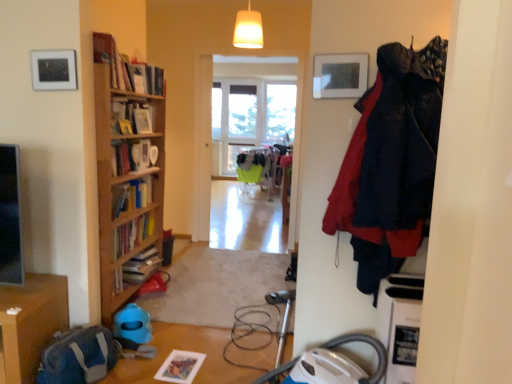
Question: Looking at their shapes, would you say white glossy bookshelf at upper left is wider or thinner than matte white picture frame at upper left?

Choices:
 (A) thin
 (B) wide

Answer: (B)

Question: In the image, is white glossy bookshelf at upper left positioned in front of or behind matte white picture frame at upper left?

Choices:
 (A) front
 (B) behind

Answer: (B)

Question: Which of these objects is positioned farthest from the wooden table at lower left?

Choices:
 (A) wooden bookcase at left
 (B) clear glass window at center, the 1th window from the left
 (C) dark blue fabric coat at right
 (D) transparent glass window at center, the 2th window positioned from the left
 (E) white glossy bookshelf at upper left

Answer: (B)

Question: Which object is positioned closest to the white glossy bookshelf at upper left?

Choices:
 (A) matte white picture frame at upper left
 (B) dark blue fabric coat at right
 (C) clear glass window at center, which ranks as the 2th window in right-to-left order
 (D) wooden bookcase at left
 (E) transparent glass window at center, the 2th window positioned from the left

Answer: (D)